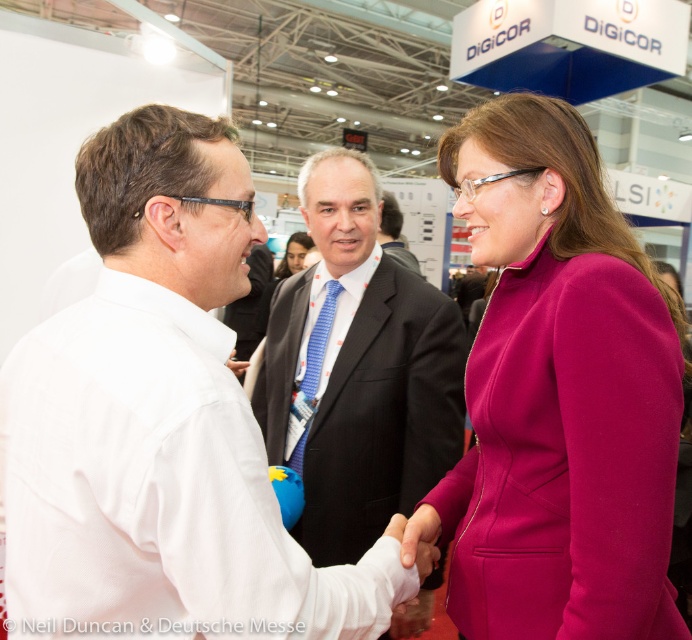
Does blue striped tie at center have a smaller size compared to dark suit at center?

Incorrect, blue striped tie at center is not smaller in size than dark suit at center.

The height and width of the screenshot is (640, 692). What do you see at coordinates (356, 369) in the screenshot?
I see `blue striped tie at center` at bounding box center [356, 369].

What do you see at coordinates (356, 369) in the screenshot? I see `blue striped tie at center` at bounding box center [356, 369].

Where is `blue striped tie at center`? This screenshot has width=692, height=640. blue striped tie at center is located at coordinates (356, 369).

Can you confirm if fuchsia woolen suit at center is wider than dark suit at center?

Yes, fuchsia woolen suit at center is wider than dark suit at center.

Find the location of a particular element. The image size is (692, 640). fuchsia woolen suit at center is located at coordinates (556, 396).

Is point (608, 397) less distant than point (390, 237)?

Yes, it is in front of point (390, 237).

Locate an element on the screen. The width and height of the screenshot is (692, 640). fuchsia woolen suit at center is located at coordinates (556, 396).

Can you confirm if fuchsia woolen suit at center is shorter than blue striped tie at center?

Yes, fuchsia woolen suit at center is shorter than blue striped tie at center.

Does point (614, 561) lie behind point (340, 490)?

No, it is in front of (340, 490).

Between point (480, 150) and point (392, 317), which one is positioned in front?

Point (480, 150)

At what (x,y) coordinates should I click in order to perform the action: click on fuchsia woolen suit at center. Please return your answer as a coordinate pair (x, y). Image resolution: width=692 pixels, height=640 pixels. Looking at the image, I should click on (556, 396).